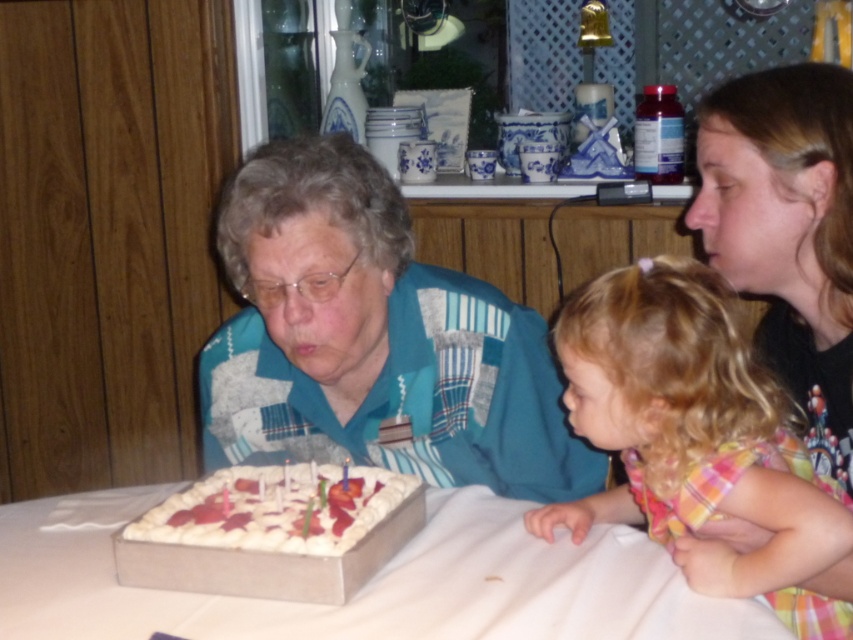
Does teal patchwork shirt at center have a greater height compared to blonde hair at lower right?

Yes.

Can you confirm if teal patchwork shirt at center is wider than blonde hair at lower right?

Yes, teal patchwork shirt at center is wider than blonde hair at lower right.

You are a GUI agent. You are given a task and a screenshot of the screen. Output one action in this format:
    pyautogui.click(x=<x>, y=<y>)
    Task: Click on the teal patchwork shirt at center
    The image size is (853, 640).
    Given the screenshot: What is the action you would take?
    pyautogui.click(x=372, y=340)

Does blonde hair at lower right appear over white textured cake at center?

Indeed, blonde hair at lower right is positioned over white textured cake at center.

Can you confirm if blonde hair at lower right is positioned to the right of white textured cake at center?

Indeed, blonde hair at lower right is positioned on the right side of white textured cake at center.

Is point (769, 444) behind point (126, 531)?

Yes, it is behind point (126, 531).

I want to click on blonde hair at lower right, so click(x=695, y=436).

Does teal patchwork shirt at center appear on the left side of white cardboard cake at lower center?

No, teal patchwork shirt at center is not to the left of white cardboard cake at lower center.

Based on the photo, does teal patchwork shirt at center have a lesser width compared to white cardboard cake at lower center?

Correct, teal patchwork shirt at center's width is less than white cardboard cake at lower center's.

Describe the element at coordinates (372, 340) in the screenshot. The width and height of the screenshot is (853, 640). I see `teal patchwork shirt at center` at that location.

At what (x,y) coordinates should I click in order to perform the action: click on teal patchwork shirt at center. Please return your answer as a coordinate pair (x, y). The height and width of the screenshot is (640, 853). Looking at the image, I should click on (372, 340).